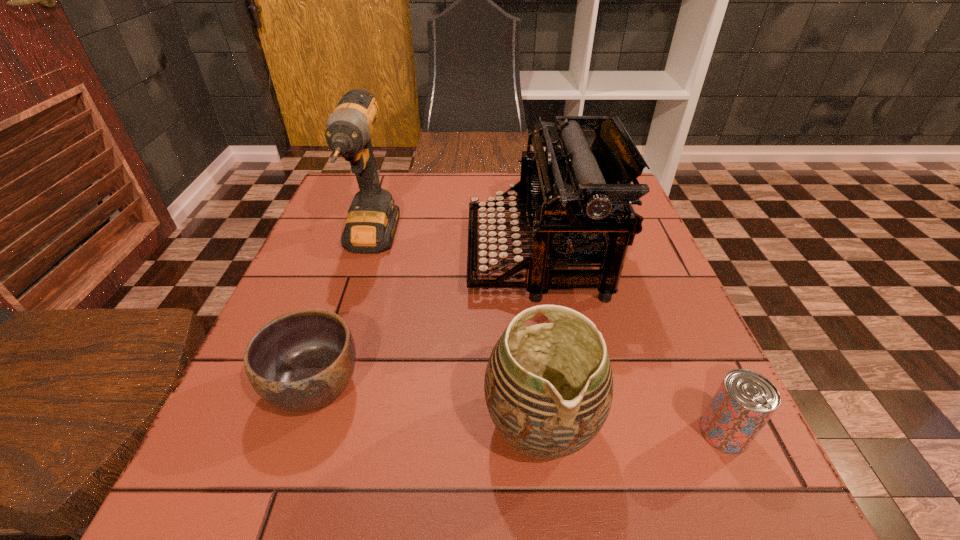
Locate which object ranks in proximity to the bowl. Please provide its 2D coordinates. Your answer should be formatted as a tuple, i.e. [(x, y)], where the tuple contains the x and y coordinates of a point satisfying the conditions above.

[(576, 196)]

Select which object is the second closest to the typewriter. Please provide its 2D coordinates. Your answer should be formatted as a tuple, i.e. [(x, y)], where the tuple contains the x and y coordinates of a point satisfying the conditions above.

[(372, 219)]

Find the location of a particular element. free location that satisfies the following two spatial constraints: 1. on the back side of the beer can; 2. on the typing side of the typewriter is located at coordinates (644, 255).

Image resolution: width=960 pixels, height=540 pixels. Identify the location of vacant point that satisfies the following two spatial constraints: 1. with the drill bit of the beer can facing forward; 2. on the left side of the drill. (311, 433).

Where is `free spot that satisfies the following two spatial constraints: 1. with the drill bit of the rightmost object facing forward; 2. on the right side of the drill`? The image size is (960, 540). free spot that satisfies the following two spatial constraints: 1. with the drill bit of the rightmost object facing forward; 2. on the right side of the drill is located at coordinates (311, 433).

The height and width of the screenshot is (540, 960). Find the location of `vacant region that satisfies the following two spatial constraints: 1. on the typing side of the fourth shortest object; 2. on the front side of the bowl`. vacant region that satisfies the following two spatial constraints: 1. on the typing side of the fourth shortest object; 2. on the front side of the bowl is located at coordinates (558, 386).